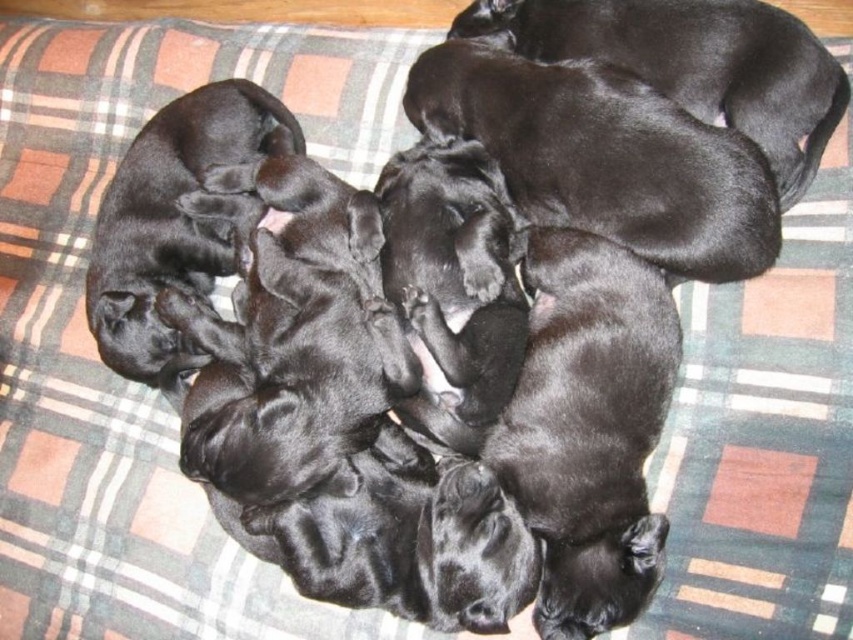
What do you see at coordinates (589, 428) in the screenshot? This screenshot has width=853, height=640. I see `black smooth fur puppies at center` at bounding box center [589, 428].

Does black smooth fur puppies at center appear on the right side of black smooth puppies at left?

Indeed, black smooth fur puppies at center is positioned on the right side of black smooth puppies at left.

Locate an element on the screen. black smooth fur puppies at center is located at coordinates (589, 428).

Does shiny black puppies at upper right appear under black smooth puppies at left?

No, shiny black puppies at upper right is not below black smooth puppies at left.

The image size is (853, 640). In order to click on shiny black puppies at upper right in this screenshot , I will do tap(695, 64).

Where is `shiny black puppies at upper right`? The image size is (853, 640). shiny black puppies at upper right is located at coordinates (695, 64).

Between black smooth fur puppies at center and shiny black puppies at upper right, which one is positioned higher?

shiny black puppies at upper right

Which is in front, point (544, 364) or point (625, 36)?

Point (544, 364) is more forward.

Is point (641, 410) in front of point (482, 8)?

Yes, point (641, 410) is in front of point (482, 8).

Find the location of a particular element. black smooth fur puppies at center is located at coordinates (589, 428).